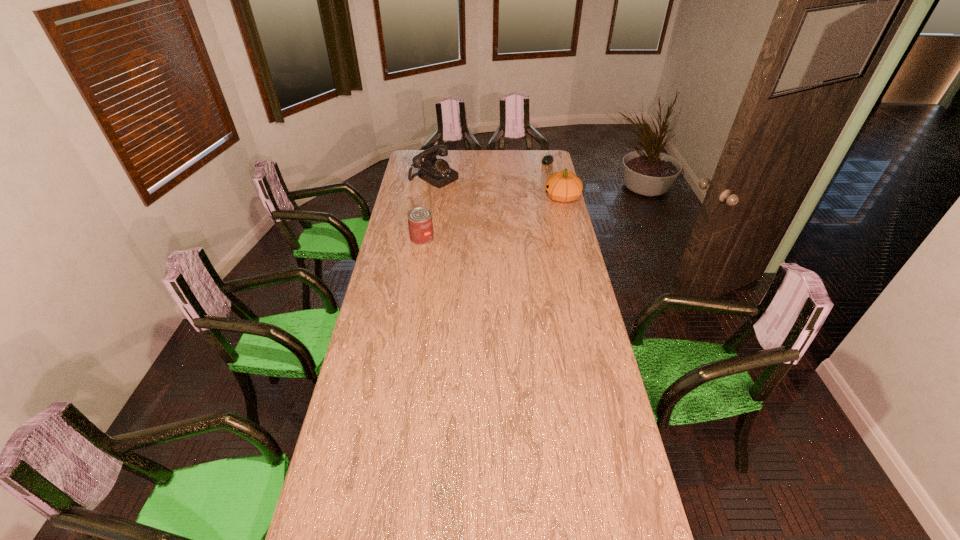
The image size is (960, 540). I want to click on gourd that is at the right edge, so click(563, 186).

At what (x,y) coordinates should I click in order to perform the action: click on computer mouse located at the right edge. Please return your answer as a coordinate pair (x, y). This screenshot has height=540, width=960. Looking at the image, I should click on (547, 159).

Identify the location of object present at the far left corner. This screenshot has height=540, width=960. (436, 172).

Image resolution: width=960 pixels, height=540 pixels. Identify the location of object located at the far right corner. (547, 159).

Where is `free space at the near edge`? Image resolution: width=960 pixels, height=540 pixels. free space at the near edge is located at coordinates point(540,509).

Image resolution: width=960 pixels, height=540 pixels. Find the location of `free space at the left edge of the desktop`. free space at the left edge of the desktop is located at coordinates (356, 410).

In the image, there is a desktop. Identify the location of free region at the right edge. (560, 206).

The width and height of the screenshot is (960, 540). What are the coordinates of `free spot at the near right corner of the desktop` in the screenshot? It's located at (628, 497).

Locate an element on the screen. The image size is (960, 540). free space that is in between the can and the telephone is located at coordinates (428, 208).

Image resolution: width=960 pixels, height=540 pixels. I want to click on vacant space that's between the gourd and the telephone, so click(x=498, y=188).